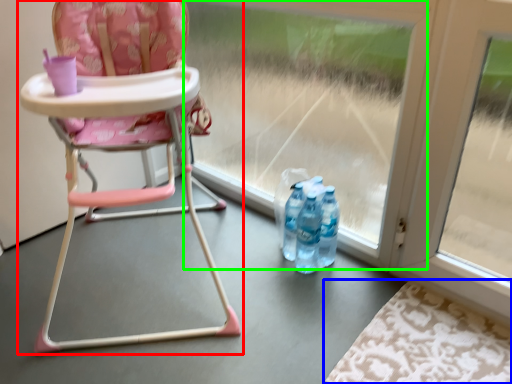
Question: Based on their relative distances, which object is farther from chair (highlighted by a red box)? Choose from mat (highlighted by a blue box) and glass door (highlighted by a green box).

Choices:
 (A) mat
 (B) glass door

Answer: (A)